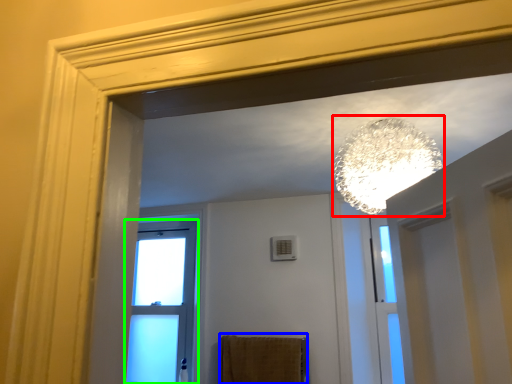
Question: Which object is the closest to the lamp (highlighted by a red box)? Choose among these: bath towel (highlighted by a blue box) or window (highlighted by a green box).

Choices:
 (A) bath towel
 (B) window

Answer: (A)